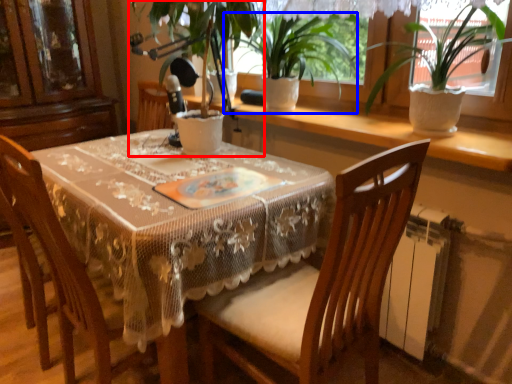
Question: Which object appears farthest to the camera in this image, houseplant (highlighted by a red box) or houseplant (highlighted by a blue box)?

Choices:
 (A) houseplant
 (B) houseplant

Answer: (B)